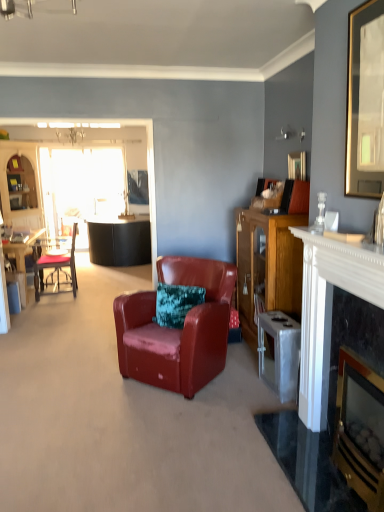
Where is `vacant area that is in front of metallic silver trash can at right`? vacant area that is in front of metallic silver trash can at right is located at coordinates point(268,405).